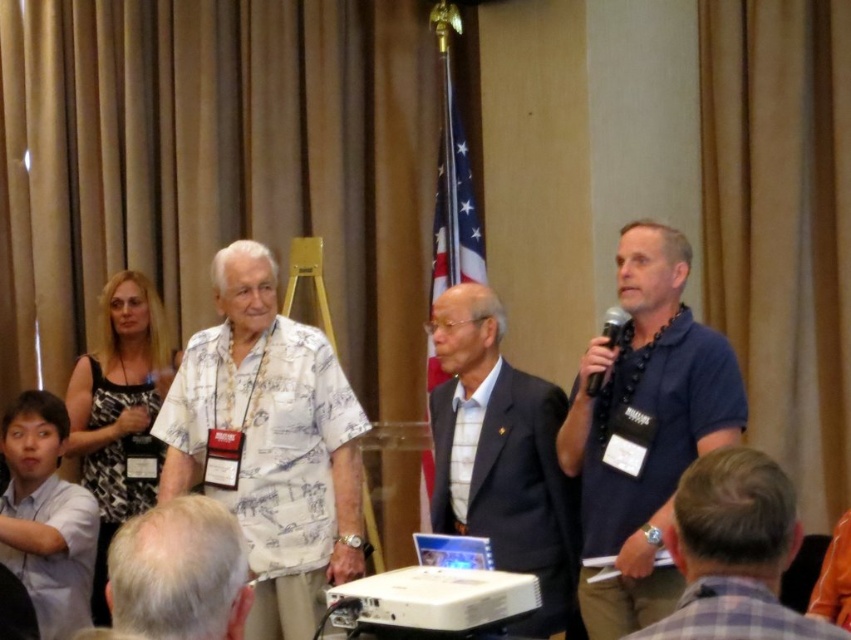
Does gray hair at center have a greater width compared to white shirt at lower left?

In fact, gray hair at center might be narrower than white shirt at lower left.

Which is more to the right, gray hair at center or white shirt at lower left?

gray hair at center is more to the right.

Locate an element on the screen. The width and height of the screenshot is (851, 640). gray hair at center is located at coordinates (180, 572).

In the scene shown: Is dark blue shirt at right further to the viewer compared to gray plaid shirt at lower right?

Yes, dark blue shirt at right is behind gray plaid shirt at lower right.

Between dark blue shirt at right and gray plaid shirt at lower right, which one has more height?

dark blue shirt at right

Which is behind, point (600, 433) or point (687, 577)?

Point (600, 433)

Find the location of a particular element. dark blue shirt at right is located at coordinates (644, 428).

Which is in front, point (333, 352) or point (75, 627)?

Positioned in front is point (75, 627).

Can you confirm if white printed shirt at center is positioned above white shirt at lower left?

Correct, white printed shirt at center is located above white shirt at lower left.

Who is more distant from viewer, (x=295, y=502) or (x=0, y=509)?

Positioned behind is point (x=0, y=509).

Find the location of a particular element. Image resolution: width=851 pixels, height=640 pixels. white printed shirt at center is located at coordinates (269, 442).